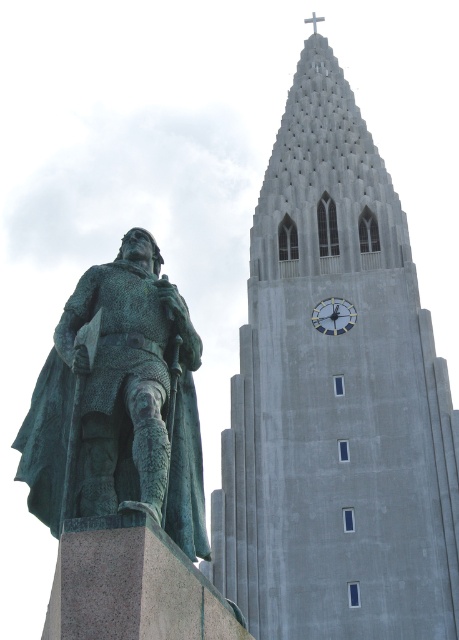
Question: Does gray concrete tower at upper center have a larger size compared to green patina statue at left?

Choices:
 (A) no
 (B) yes

Answer: (B)

Question: Which of the following is the closest to the observer?

Choices:
 (A) gray concrete tower at upper center
 (B) green patina statue at left
 (C) metallic gray clock at center

Answer: (B)

Question: Can you confirm if gray concrete tower at upper center is positioned above green patina statue at left?

Choices:
 (A) no
 (B) yes

Answer: (B)

Question: Estimate the real-world distances between objects in this image. Which object is closer to the gray concrete tower at upper center?

Choices:
 (A) metallic gray clock at center
 (B) green patina statue at left

Answer: (A)

Question: Can you confirm if gray concrete tower at upper center is positioned to the left of green patina statue at left?

Choices:
 (A) yes
 (B) no

Answer: (B)

Question: Among these points, which one is farthest from the camera?

Choices:
 (A) (320, 312)
 (B) (167, 376)

Answer: (A)